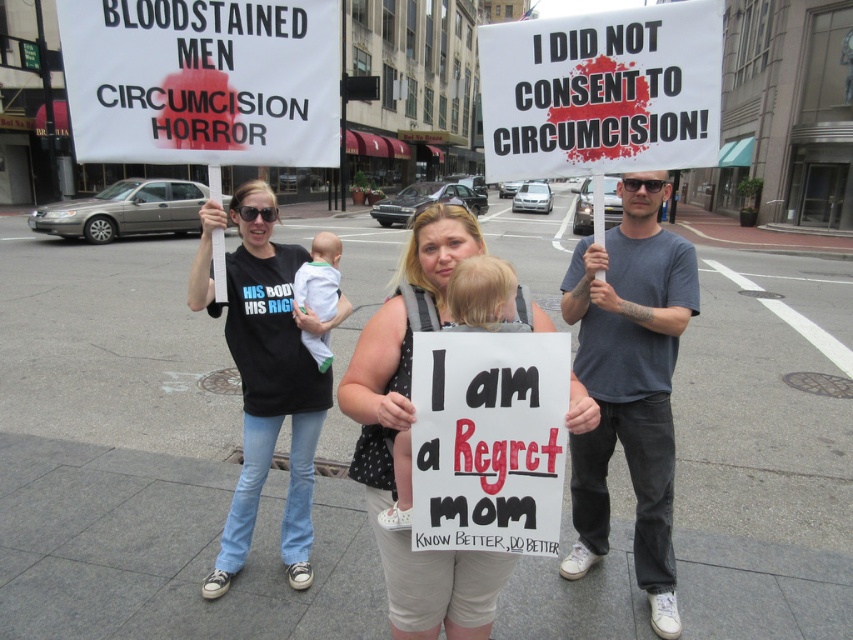
Consider the image. Does dark gray t-shirt at center appear on the left side of soft beige fabric baby at center?

No, dark gray t-shirt at center is not to the left of soft beige fabric baby at center.

Does dark gray t-shirt at center appear under soft beige fabric baby at center?

Yes, dark gray t-shirt at center is below soft beige fabric baby at center.

Does point (663, 598) lie behind point (408, 317)?

Yes, it is behind point (408, 317).

Image resolution: width=853 pixels, height=640 pixels. In order to click on dark gray t-shirt at center in this screenshot , I will do `click(630, 384)`.

Who is positioned more to the right, white paper sign at center or dark gray t-shirt at center?

Positioned to the right is dark gray t-shirt at center.

Image resolution: width=853 pixels, height=640 pixels. I want to click on white paper sign at center, so click(x=602, y=92).

Image resolution: width=853 pixels, height=640 pixels. Identify the location of white paper sign at center. (602, 92).

Locate an element on the screen. This screenshot has height=640, width=853. white paper sign at center is located at coordinates (602, 92).

Is white paper sign at upper left wider than dark gray t-shirt at center?

Yes.

Does point (212, 88) come behind point (647, 518)?

No, it is not.

Image resolution: width=853 pixels, height=640 pixels. In order to click on white paper sign at upper left in this screenshot , I will do `click(202, 81)`.